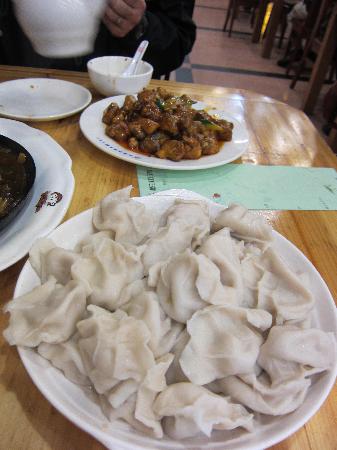
Locate an element on the screen. The image size is (337, 450). table is located at coordinates (313, 432).